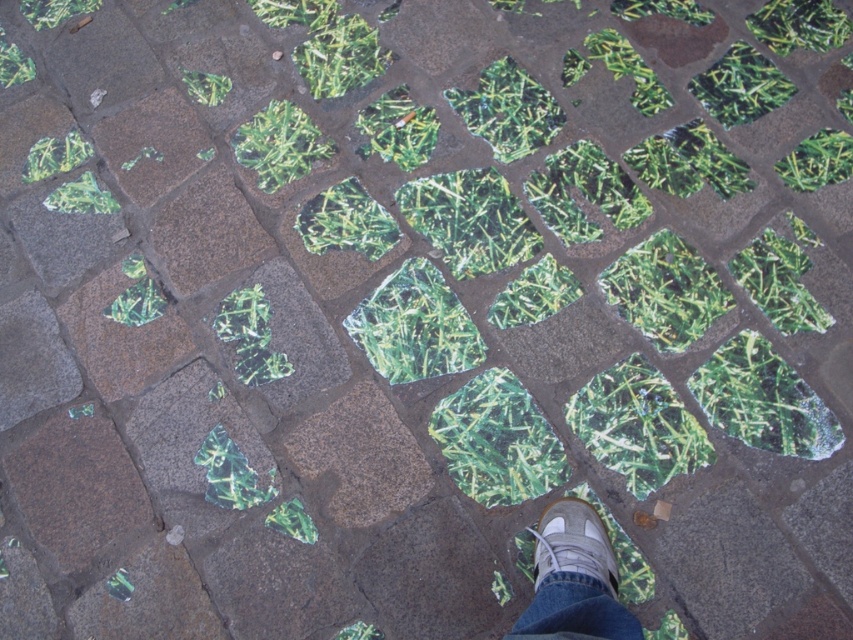
You are a shoemaker examining two shoes on a cobblestone pavement. The gray suede shoe at center and the light brown suede shoe at center are both placed on the pavement. Which one has a larger width?

The gray suede shoe at center might be wider than light brown suede shoe at center according to the description.

From the picture: You are a delivery robot that needs to place a package on the cobblestone pavement. The package requires a flat surface that is at least 2 inches wide. Can you place the package between the gray suede shoe at center and the light brown suede shoe at center?

The gray suede shoe at center is 1.74 inches away from the light brown suede shoe at center. Since the required space is 2 inches, the distance between them is insufficient. Therefore, the package cannot be placed there.

You are standing on the cobblestone pavement and see two shoes, the gray suede shoe at center and the light brown suede shoe at center. Which shoe is located to the left of the other?

The gray suede shoe at center is positioned on the left side of light brown suede shoe at center.